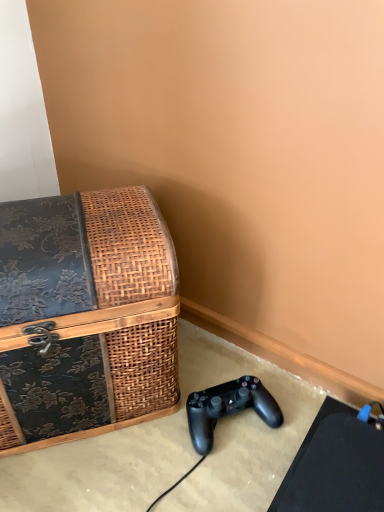
In order to click on free space that is to the left of black matte game controller at lower right in this screenshot , I will do `click(134, 450)`.